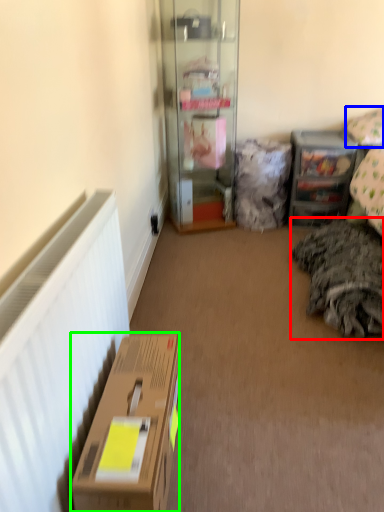
Question: Which object is positioned closest to bedding (highlighted by a red box)? Select from pillow (highlighted by a blue box) and box (highlighted by a green box).

Choices:
 (A) pillow
 (B) box

Answer: (A)